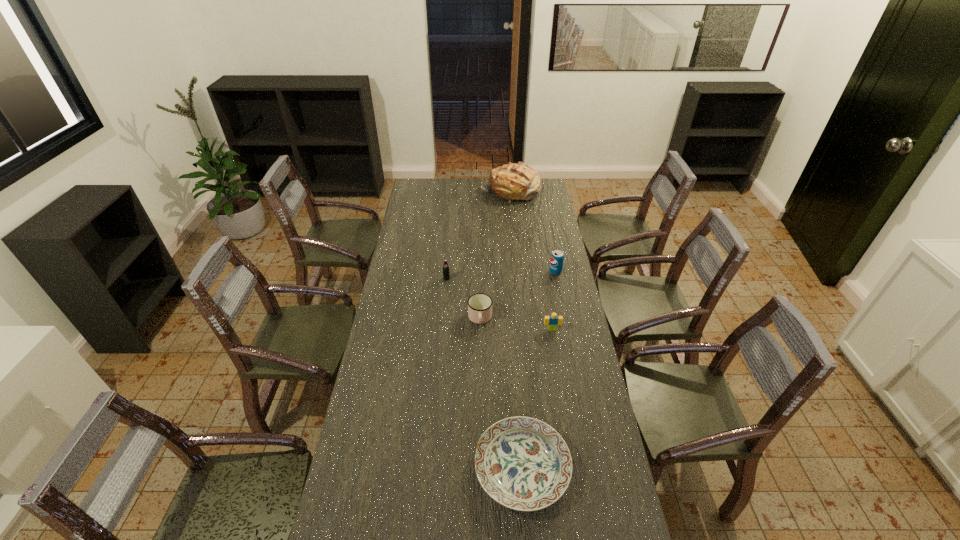
Where is `free space located 0.050m on the front of the tallest object`? The image size is (960, 540). free space located 0.050m on the front of the tallest object is located at coordinates (512, 210).

Locate an element on the screen. The height and width of the screenshot is (540, 960). free space located 0.090m on the left of the farther pop is located at coordinates (530, 272).

Where is `vacant area located 0.160m on the front label of the left pop`? The height and width of the screenshot is (540, 960). vacant area located 0.160m on the front label of the left pop is located at coordinates (444, 305).

This screenshot has width=960, height=540. In order to click on vacant space located 0.330m on the face of the Lego in this screenshot , I will do `click(564, 403)`.

Find the location of a particular element. Image resolution: width=960 pixels, height=540 pixels. vacant space situated on the side of the mug with the handle is located at coordinates (480, 421).

Find the location of `vacant space located on the back of the shortest object`. vacant space located on the back of the shortest object is located at coordinates (516, 380).

Locate an element on the screen. object present at the far edge is located at coordinates (519, 181).

Find the location of `bread that is at the right edge`. bread that is at the right edge is located at coordinates (519, 181).

Locate an element on the screen. The height and width of the screenshot is (540, 960). soda can situated at the right edge is located at coordinates (557, 257).

Find the location of a particular element. Lego that is at the right edge is located at coordinates (552, 321).